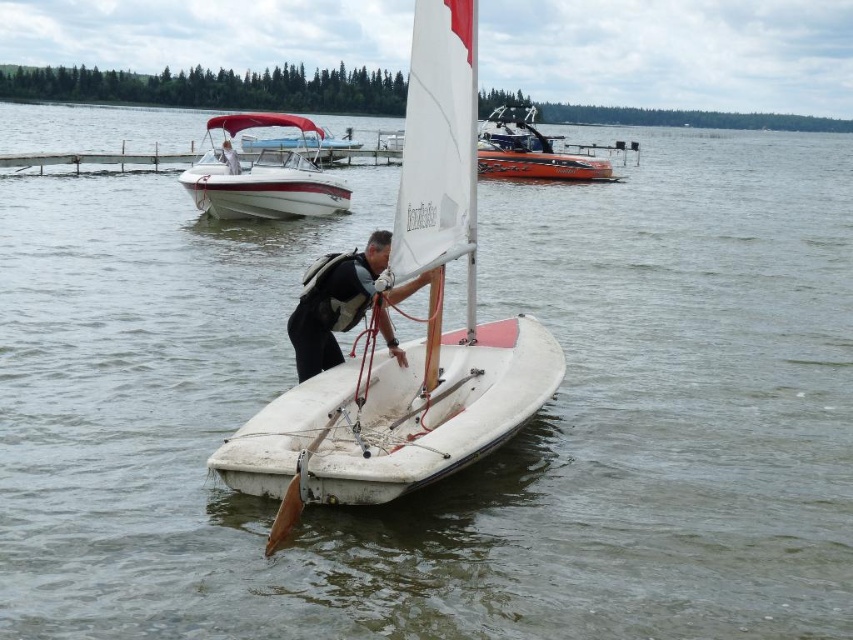
You are planning to dock your boat at the marina, and you see the white matte sailboat at center and the white glossy boat at upper left. Which boat is shorter and would require a smaller docking space?

The white matte sailboat at center is shorter than the white glossy boat at upper left, so it would require a smaller docking space.

You are a drone operator trying to capture a photo of the white matte sailboat at center. The drone is currently at point 0.5, 0.5. Can you confirm if the drone is directly above the sailboat?

The white matte sailboat at center is located at point (x=412, y=340), so the drone at (x=426, y=320) is not directly above it. The drone needs to move slightly east and north to align with the sailboat.